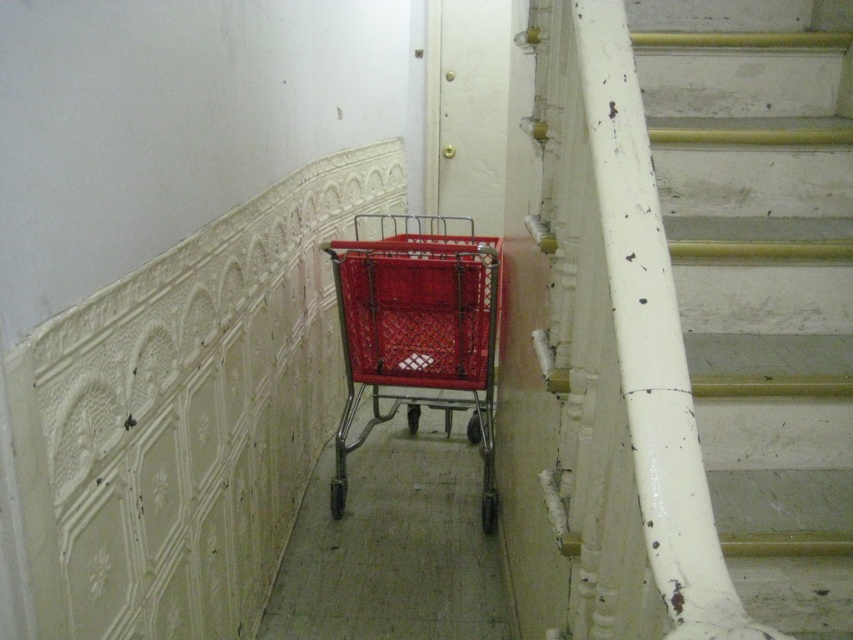
Question: Where is white painted wood stairs at right located in relation to red plastic shopping cart at center in the image?

Choices:
 (A) above
 (B) below

Answer: (A)

Question: Among these objects, which one is nearest to the camera?

Choices:
 (A) red plastic shopping cart at center
 (B) white painted wood stairs at right

Answer: (B)

Question: Is white painted wood stairs at right thinner than red plastic shopping cart at center?

Choices:
 (A) yes
 (B) no

Answer: (A)

Question: Which of the following is the farthest from the observer?

Choices:
 (A) white painted wood stairs at right
 (B) red plastic shopping cart at center

Answer: (B)

Question: Is white painted wood stairs at right wider than red plastic shopping cart at center?

Choices:
 (A) no
 (B) yes

Answer: (A)

Question: Which of the following is the closest to the observer?

Choices:
 (A) (611, 157)
 (B) (345, 246)

Answer: (A)